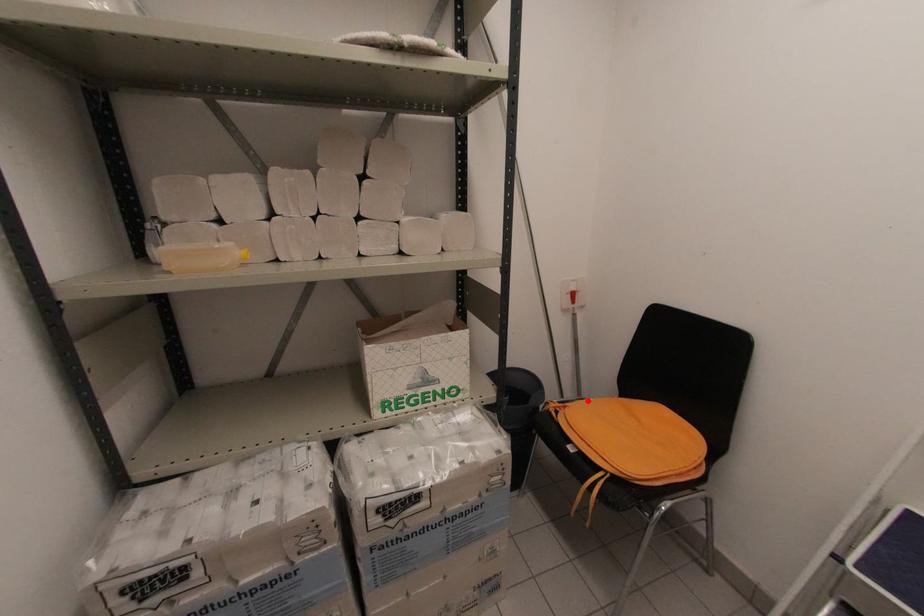
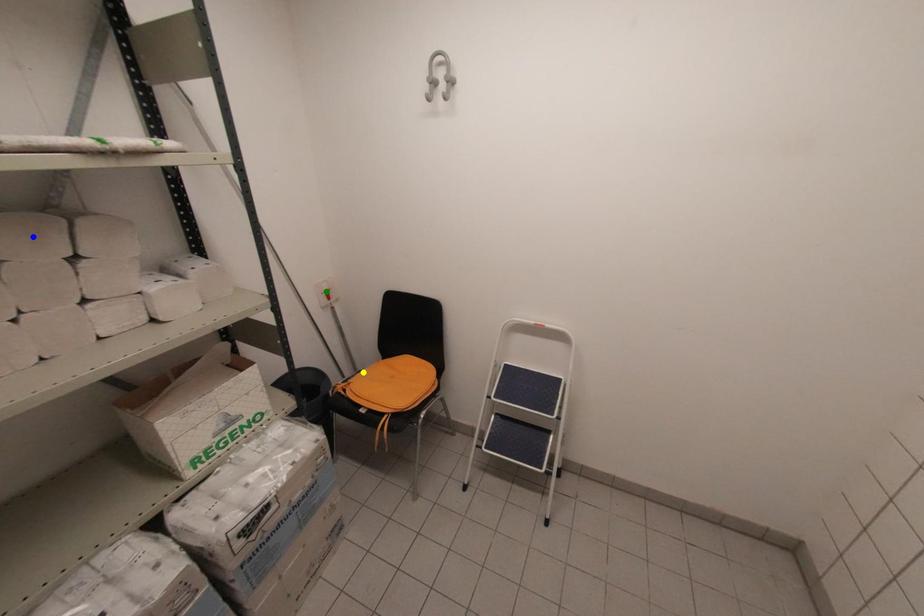
Question: I am providing you with two images of the same scene from different viewpoints. A red point is marked on the first image. You are given multiple points on the second image. Which point in image 2 is actually the same real-world point as the red point in image 1?

Choices:
 (A) yellow point
 (B) green point
 (C) blue point

Answer: (A)